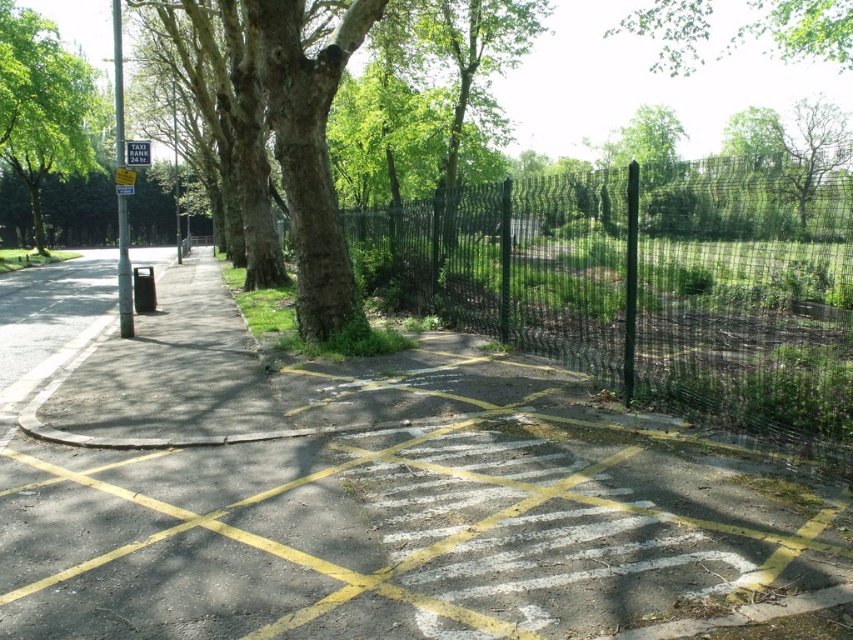
Question: Which point is closer to the camera taking this photo?

Choices:
 (A) (784, 195)
 (B) (525, 600)
 (C) (143, 154)
 (D) (619, 26)

Answer: (B)

Question: Considering the relative positions of yellow painted lines at center and green wire mesh fence at center in the image provided, where is yellow painted lines at center located with respect to green wire mesh fence at center?

Choices:
 (A) above
 (B) below

Answer: (B)

Question: Is the position of green leafy tree at upper center less distant than that of metallic rectangular sign at upper left?

Choices:
 (A) yes
 (B) no

Answer: (B)

Question: Does yellow painted lines at center come in front of metallic rectangular sign at upper left?

Choices:
 (A) no
 (B) yes

Answer: (B)

Question: Which point is closer to the camera taking this photo?

Choices:
 (A) (540, 371)
 (B) (49, 118)

Answer: (A)

Question: Among these objects, which one is farthest from the camera?

Choices:
 (A) metallic rectangular sign at upper left
 (B) green wire mesh fence at center
 (C) green leafy tree at upper center
 (D) green rough bark tree at upper left

Answer: (C)